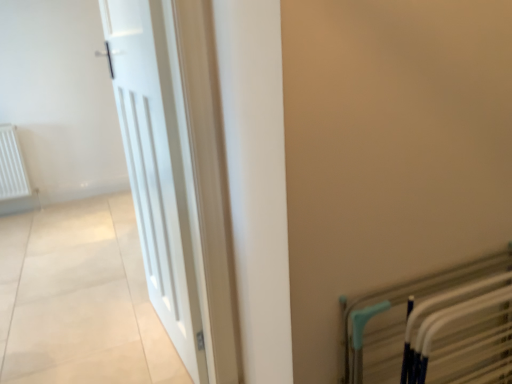
Question: From a real-world perspective, is metallic silver bed frame at lower right above or below white wooden door at left?

Choices:
 (A) below
 (B) above

Answer: (A)

Question: In the image, is metallic silver bed frame at lower right positioned in front of or behind white wooden door at left?

Choices:
 (A) behind
 (B) front

Answer: (B)

Question: Is metallic silver bed frame at lower right inside or outside of white wooden door at left?

Choices:
 (A) inside
 (B) outside

Answer: (B)

Question: Is point (157, 145) closer or farther from the camera than point (391, 297)?

Choices:
 (A) farther
 (B) closer

Answer: (A)

Question: Based on their sizes in the image, would you say white wooden door at left is bigger or smaller than metallic silver bed frame at lower right?

Choices:
 (A) big
 (B) small

Answer: (A)

Question: In terms of width, does white wooden door at left look wider or thinner when compared to metallic silver bed frame at lower right?

Choices:
 (A) thin
 (B) wide

Answer: (B)

Question: In terms of height, does white wooden door at left look taller or shorter compared to metallic silver bed frame at lower right?

Choices:
 (A) short
 (B) tall

Answer: (B)